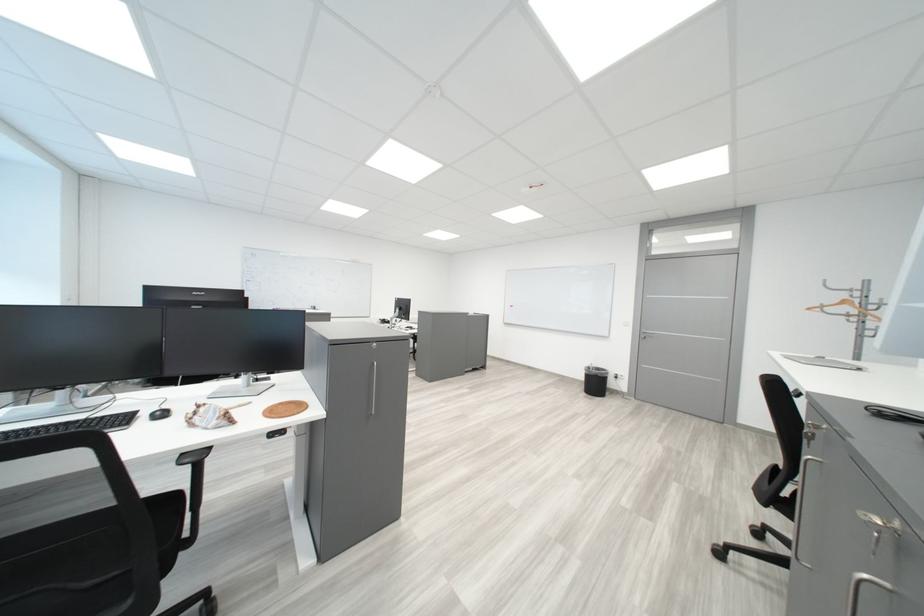
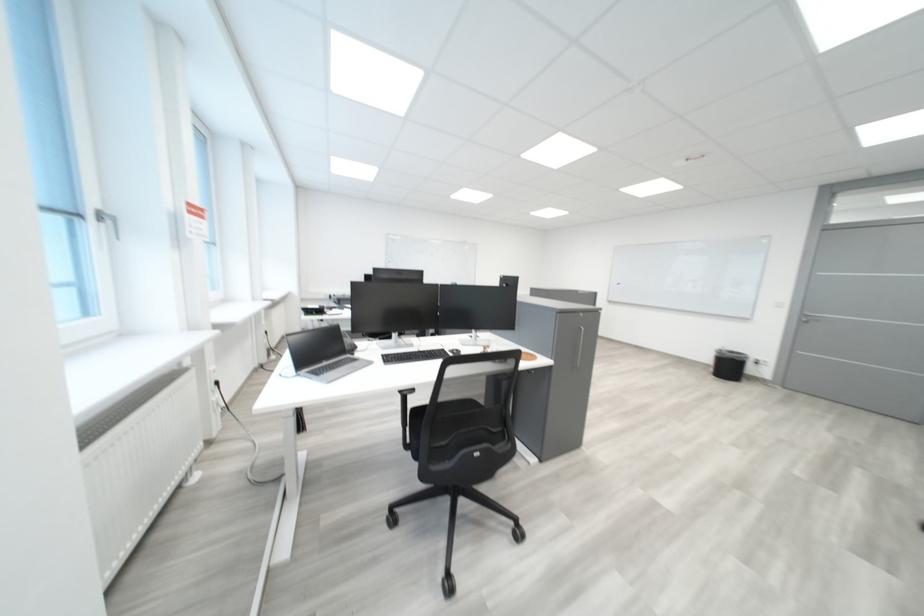
Locate, in the second image, the point that corresponds to (x=609, y=386) in the first image.

(743, 369)